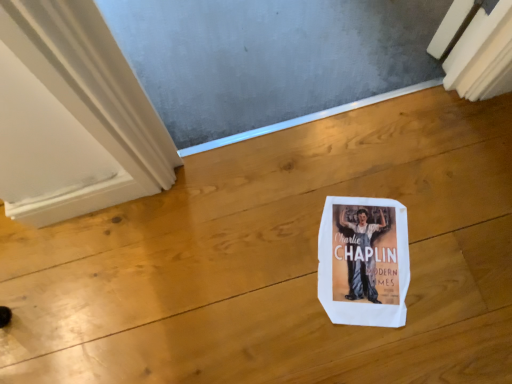
I want to click on unoccupied space behind white paper bag at center, so click(x=341, y=159).